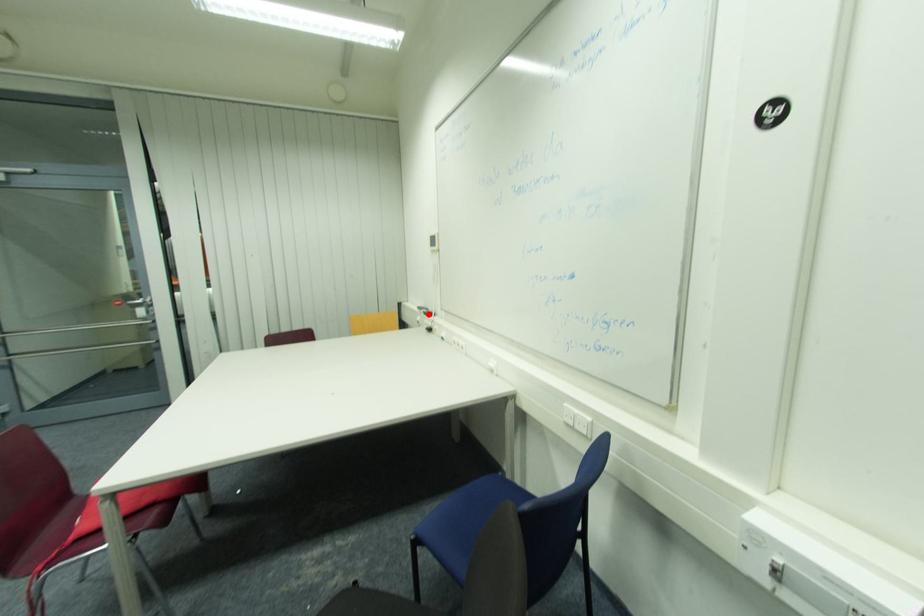
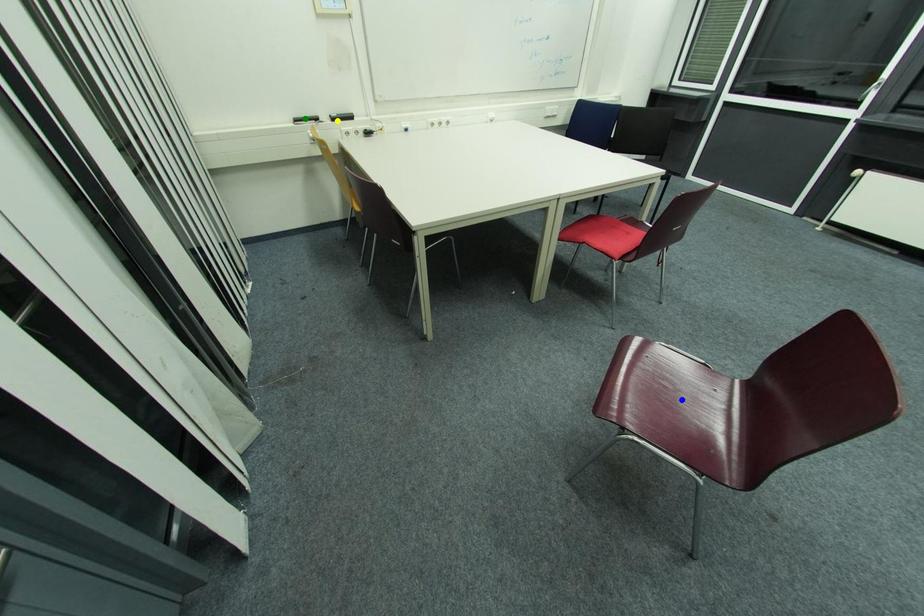
Question: I am providing you with two images of the same scene from different viewpoints. A red point is marked on the first image. You are given multiple points on the second image. Which mark in image 2 goes with the point in image 1?

Choices:
 (A) yellow point
 (B) green point
 (C) blue point

Answer: (A)